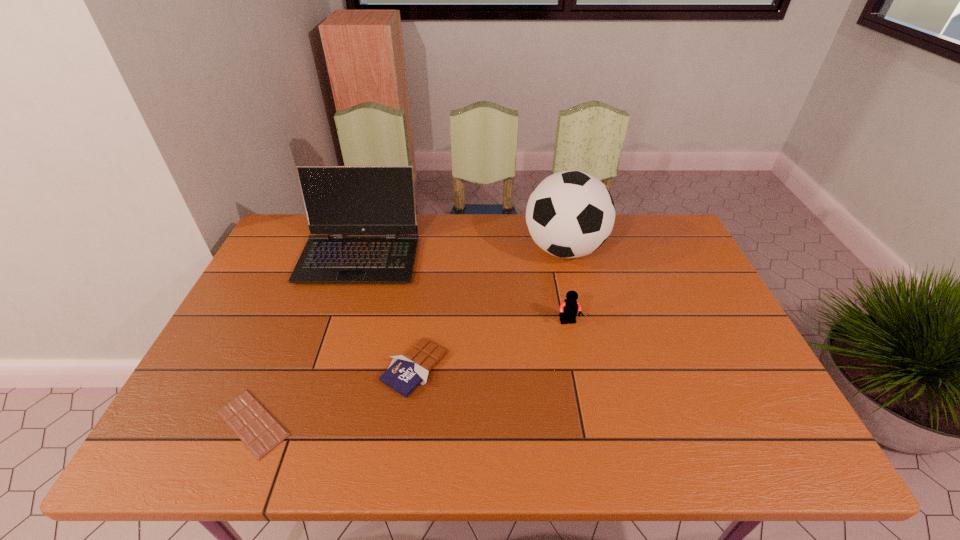
You are a GUI agent. You are given a task and a screenshot of the screen. Output one action in this format:
    pyautogui.click(x=<x>, y=<y>)
    Task: Click on the soccer ball
    
    Given the screenshot: What is the action you would take?
    pyautogui.click(x=570, y=214)

Locate an element on the screen. The width and height of the screenshot is (960, 540). laptop computer is located at coordinates (339, 200).

You are a GUI agent. You are given a task and a screenshot of the screen. Output one action in this format:
    pyautogui.click(x=<x>, y=<y>)
    Task: Click on the third nearest object
    The width and height of the screenshot is (960, 540).
    Given the screenshot: What is the action you would take?
    pyautogui.click(x=569, y=308)

Identify the location of the third tallest object. (569, 308).

This screenshot has width=960, height=540. Find the location of `the right chocolate bar`. the right chocolate bar is located at coordinates (405, 373).

I want to click on the second shortest object, so click(x=405, y=373).

What are the coordinates of `the shortest object` in the screenshot? It's located at (257, 428).

Find the location of a particular element. This screenshot has height=540, width=960. the shorter chocolate bar is located at coordinates (257, 428).

You are a GUI agent. You are given a task and a screenshot of the screen. Output one action in this format:
    pyautogui.click(x=<x>, y=<y>)
    Task: Click on the vacant region located on the left of the soccer ball
    This screenshot has width=960, height=540.
    Given the screenshot: What is the action you would take?
    pyautogui.click(x=435, y=249)

Locate an element on the screen. The height and width of the screenshot is (540, 960). free space located 0.280m on the screen of the laptop computer is located at coordinates (325, 363).